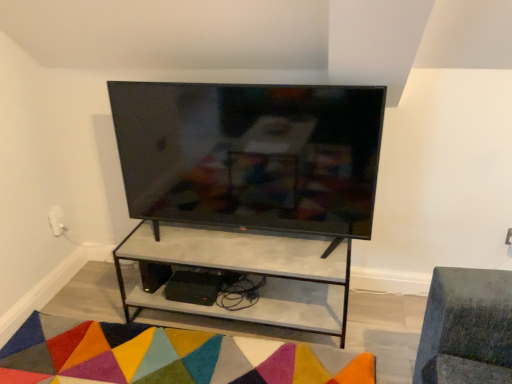
Question: In the image, is matte black tv at center positioned in front of or behind matte concrete shelf at center?

Choices:
 (A) behind
 (B) front

Answer: (B)

Question: Looking at their shapes, would you say matte black tv at center is wider or thinner than matte concrete shelf at center?

Choices:
 (A) wide
 (B) thin

Answer: (B)

Question: Which object is the closest to the multicolored felt mat at lower center?

Choices:
 (A) matte concrete shelf at center
 (B) matte black tv at center

Answer: (A)

Question: Based on their relative distances, which object is farther from the matte black tv at center?

Choices:
 (A) multicolored felt mat at lower center
 (B) matte concrete shelf at center

Answer: (A)